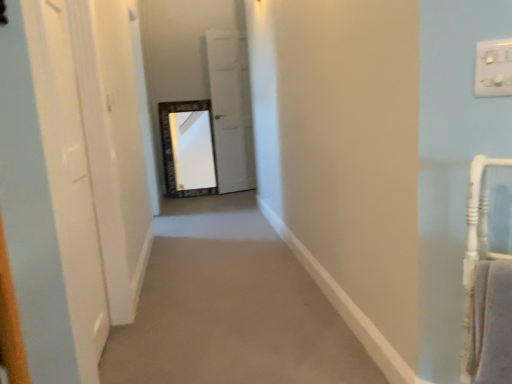
Question: From the image's perspective, does white glossy door at left, acting as the first door starting from the front, appear higher than white plastic switch at upper right?

Choices:
 (A) no
 (B) yes

Answer: (A)

Question: Is white glossy door at left, the second door positioned from the right, at the left side of white plastic switch at upper right?

Choices:
 (A) yes
 (B) no

Answer: (A)

Question: Is white glossy door at left, the second door positioned from the right, further to camera compared to white plastic switch at upper right?

Choices:
 (A) yes
 (B) no

Answer: (A)

Question: Could you tell me if white glossy door at left, the second door positioned from the right, is facing white plastic switch at upper right?

Choices:
 (A) no
 (B) yes

Answer: (A)

Question: Can you confirm if white glossy door at left, which ranks as the second door in back-to-front order, is thinner than white plastic switch at upper right?

Choices:
 (A) no
 (B) yes

Answer: (A)

Question: Is white glossy door at left, acting as the first door starting from the front, to the right of white plastic switch at upper right from the viewer's perspective?

Choices:
 (A) no
 (B) yes

Answer: (A)

Question: From a real-world perspective, is white glossy door at left, marked as the 1th door in a left-to-right arrangement, physically above white matte door at center, the 2th door when ordered from front to back?

Choices:
 (A) yes
 (B) no

Answer: (B)

Question: From the image's perspective, is white glossy door at left, which ranks as the second door in back-to-front order, over white matte door at center, the 1th door positioned from the right?

Choices:
 (A) yes
 (B) no

Answer: (B)

Question: Considering the relative positions of white glossy door at left, marked as the 1th door in a left-to-right arrangement, and white matte door at center, the first door when ordered from back to front, in the image provided, is white glossy door at left, marked as the 1th door in a left-to-right arrangement, to the left of white matte door at center, the first door when ordered from back to front, from the viewer's perspective?

Choices:
 (A) no
 (B) yes

Answer: (B)

Question: Is white glossy door at left, marked as the 1th door in a left-to-right arrangement, positioned in front of white matte door at center, the first door when ordered from back to front?

Choices:
 (A) no
 (B) yes

Answer: (B)

Question: Does white glossy door at left, marked as the 1th door in a left-to-right arrangement, have a smaller size compared to white matte door at center, the 1th door positioned from the right?

Choices:
 (A) yes
 (B) no

Answer: (A)

Question: Can you confirm if white glossy door at left, acting as the first door starting from the front, is taller than white matte door at center, the 1th door positioned from the right?

Choices:
 (A) yes
 (B) no

Answer: (B)

Question: From a real-world perspective, is white plastic switch at upper right over white matte door at center, the 2th door in the left-to-right sequence?

Choices:
 (A) no
 (B) yes

Answer: (B)